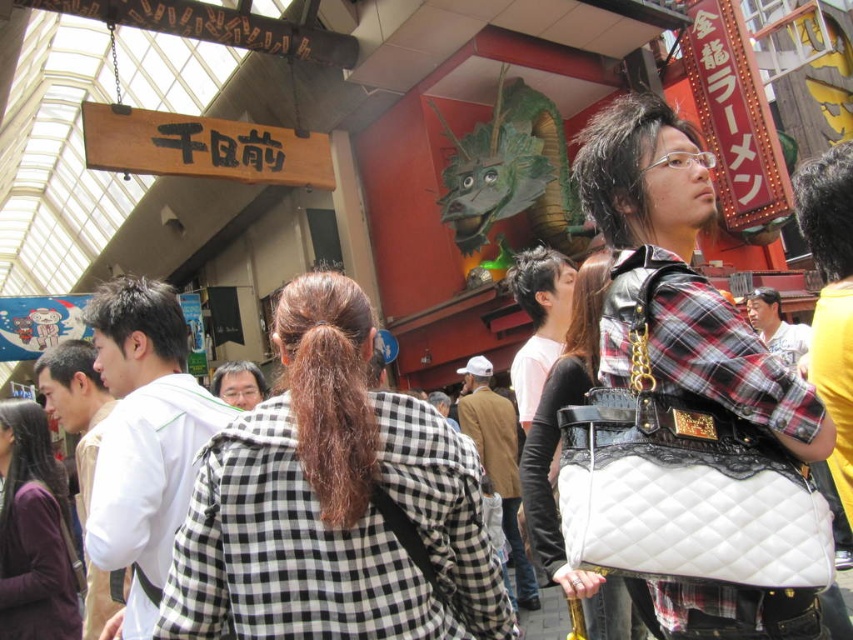
Question: Which of the following is the farthest from the observer?

Choices:
 (A) black checkered jacket at center
 (B) white quilted leather handbag at center
 (C) dark purple sweater at center

Answer: (C)

Question: In this image, where is white quilted leather handbag at center located relative to dark purple sweater at center?

Choices:
 (A) left
 (B) right

Answer: (B)

Question: Which object appears closest to the camera in this image?

Choices:
 (A) dark purple sweater at center
 (B) white quilted leather handbag at center

Answer: (B)

Question: Can you confirm if black checkered jacket at center is bigger than dark purple sweater at center?

Choices:
 (A) no
 (B) yes

Answer: (B)

Question: Which of the following is the farthest from the observer?

Choices:
 (A) (558, 397)
 (B) (27, 548)

Answer: (B)

Question: Is black checkered jacket at center wider than dark purple sweater at center?

Choices:
 (A) yes
 (B) no

Answer: (A)